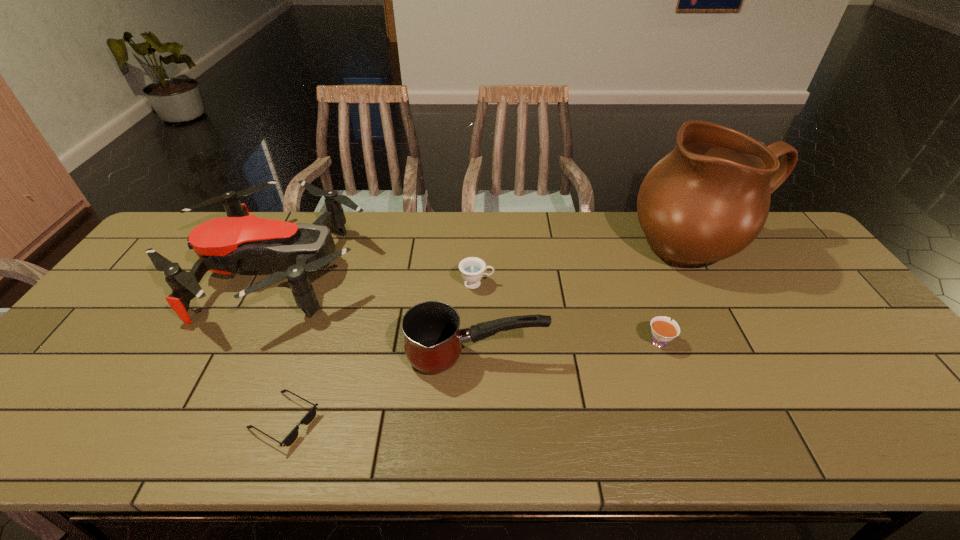
The height and width of the screenshot is (540, 960). What are the coordinates of `object located at the right edge` in the screenshot? It's located at (708, 199).

At what (x,y) coordinates should I click in order to perform the action: click on object that is at the far left corner. Please return your answer as a coordinate pair (x, y). This screenshot has height=540, width=960. Looking at the image, I should click on (223, 245).

Image resolution: width=960 pixels, height=540 pixels. What are the coordinates of `object positioned at the far right corner` in the screenshot? It's located at (708, 199).

Where is `vacant area at the far edge of the desktop`? Image resolution: width=960 pixels, height=540 pixels. vacant area at the far edge of the desktop is located at coordinates (365, 217).

The width and height of the screenshot is (960, 540). In the image, there is a desktop. What are the coordinates of `vacant space at the near edge` in the screenshot? It's located at (628, 437).

In the image, there is a desktop. Identify the location of vacant space at the left edge. This screenshot has height=540, width=960. (81, 343).

The height and width of the screenshot is (540, 960). In order to click on vacant space at the right edge in this screenshot , I will do `click(818, 275)`.

Identify the location of vacant space at the far right corner. (796, 241).

Identify the location of unoccupied area between the right teacup and the left teacup. The height and width of the screenshot is (540, 960). (567, 312).

Identify the location of free space between the shorter teacup and the left teacup. The width and height of the screenshot is (960, 540). (567, 312).